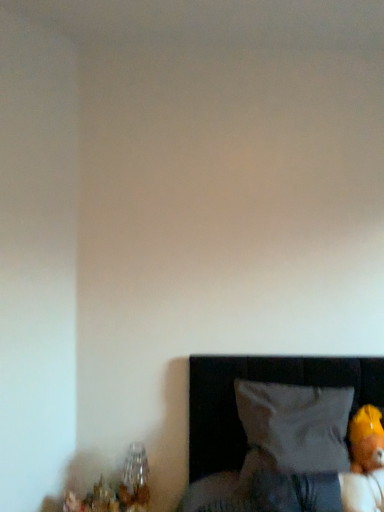
Question: Considering the relative sizes of clear glass vase at lower left and white fabric pillow at lower right in the image provided, is clear glass vase at lower left smaller than white fabric pillow at lower right?

Choices:
 (A) no
 (B) yes

Answer: (B)

Question: Can you confirm if clear glass vase at lower left is positioned to the left of white fabric pillow at lower right?

Choices:
 (A) yes
 (B) no

Answer: (A)

Question: Can you see clear glass vase at lower left touching white fabric pillow at lower right?

Choices:
 (A) yes
 (B) no

Answer: (B)

Question: From a real-world perspective, is clear glass vase at lower left under white fabric pillow at lower right?

Choices:
 (A) no
 (B) yes

Answer: (B)

Question: From the image's perspective, does clear glass vase at lower left appear higher than white fabric pillow at lower right?

Choices:
 (A) yes
 (B) no

Answer: (B)

Question: Can you confirm if clear glass vase at lower left is positioned to the right of white fabric pillow at lower right?

Choices:
 (A) no
 (B) yes

Answer: (A)

Question: Would you say clear glass vase at lower left is part of white fabric pillow at lower right's contents?

Choices:
 (A) yes
 (B) no

Answer: (B)

Question: Is white fabric pillow at lower right taller than clear glass vase at lower left?

Choices:
 (A) no
 (B) yes

Answer: (B)

Question: Does white fabric pillow at lower right appear on the left side of clear glass vase at lower left?

Choices:
 (A) yes
 (B) no

Answer: (B)

Question: Is white fabric pillow at lower right at the right side of clear glass vase at lower left?

Choices:
 (A) yes
 (B) no

Answer: (A)

Question: Is white fabric pillow at lower right with clear glass vase at lower left?

Choices:
 (A) no
 (B) yes

Answer: (A)

Question: Can you confirm if white fabric pillow at lower right is shorter than clear glass vase at lower left?

Choices:
 (A) yes
 (B) no

Answer: (B)

Question: Can you confirm if clear glass vase at lower left is thinner than soft yellow plush bear at lower right?

Choices:
 (A) yes
 (B) no

Answer: (A)